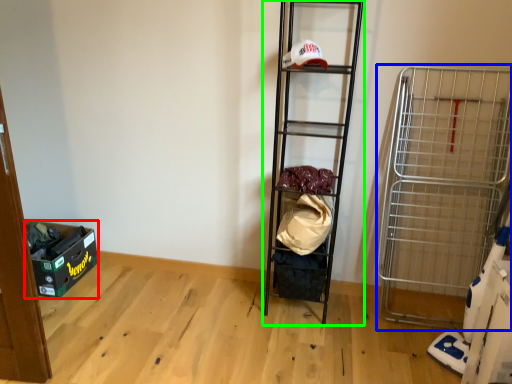
Question: Based on their relative distances, which object is farther from storage box (highlighted by a red box)? Choose from cart (highlighted by a blue box) and shelf (highlighted by a green box).

Choices:
 (A) cart
 (B) shelf

Answer: (A)